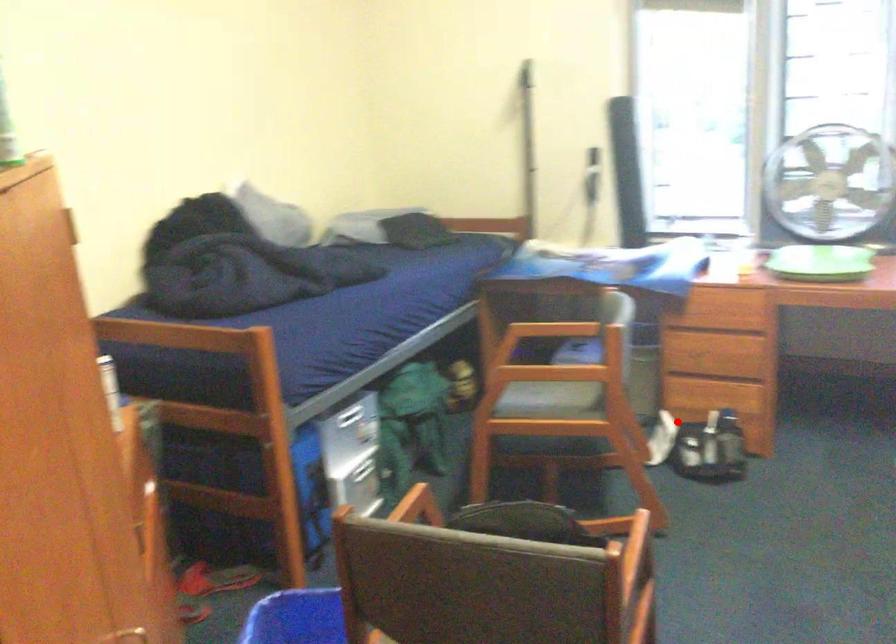
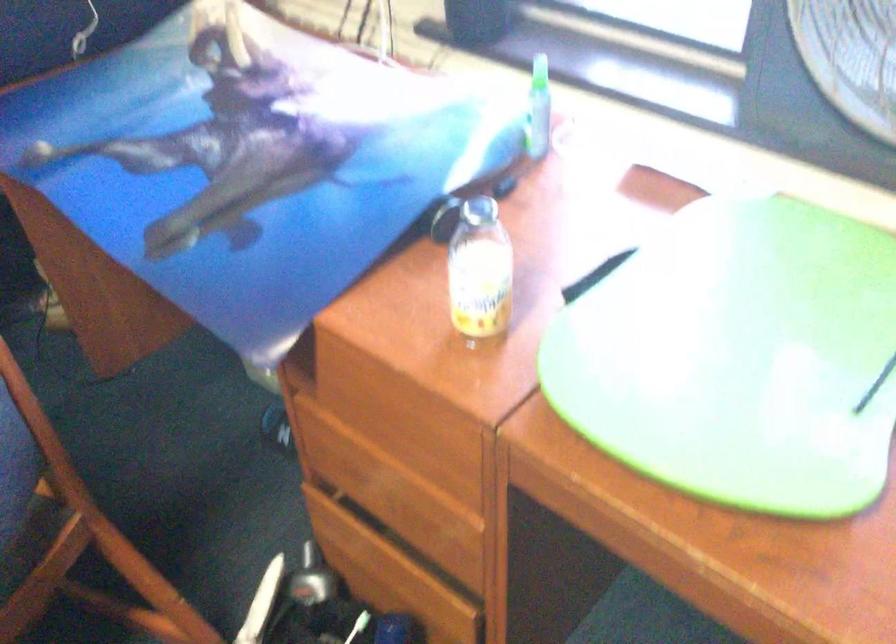
Locate, in the second image, the point that corresponds to the highlighted location in the first image.

(311, 579)